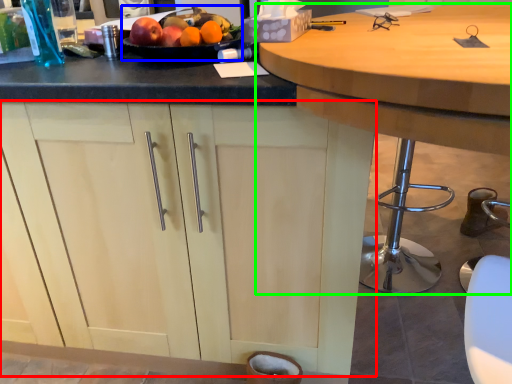
Question: Which object is positioned farthest from cabinetry (highlighted by a red box)? Select from fruit dish (highlighted by a blue box) and table (highlighted by a green box).

Choices:
 (A) fruit dish
 (B) table

Answer: (B)